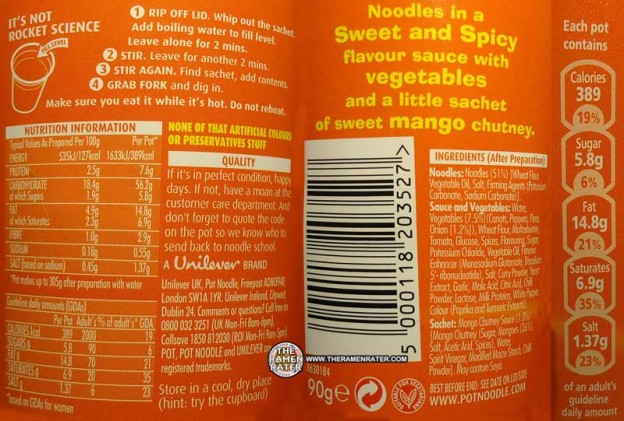
This screenshot has height=421, width=624. Find the location of `arrow pointing to the inside of the cup`. arrow pointing to the inside of the cup is located at coordinates (42, 51).